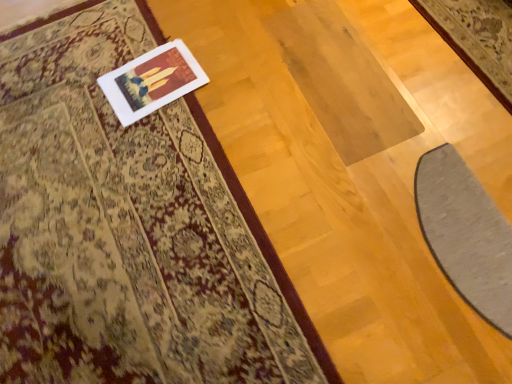
Locate an element on the screen. This screenshot has height=384, width=512. vacant area in front of white matte picture frame at upper left is located at coordinates (159, 145).